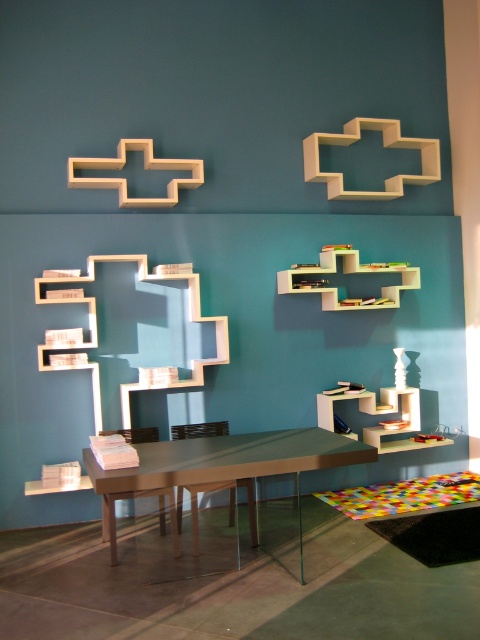
You are standing in the room and see two points marked on the teal wall. The first point is at coordinate point(319, 465) and the second is at point(282, 269). Which point is closer to you?

Point(319, 465) is in front of point(282, 269), so it is closer to you.

You are standing in the room and want to place a 1.5 meter long object on the metallic glass table at center. Can you do so without the object hanging off the edge? Please explain your reasoning.

The metallic glass table at center and viewer are 3.00 meters apart. However, the table length is not provided in the description. Therefore, it is impossible to determine if the 1.5 meter long object can be placed without overhanging.

You are a delivery person who needs to place a large package that is 1.5 meters long on the floor between the metallic glass table at center and the white matte shelf at upper center. Is there enough space for the package to fit horizontally between them?

The distance between the metallic glass table at center and the white matte shelf at upper center is 1.65 meters. Since the package is 1.5 meters long, there is enough space for it to fit horizontally between them.